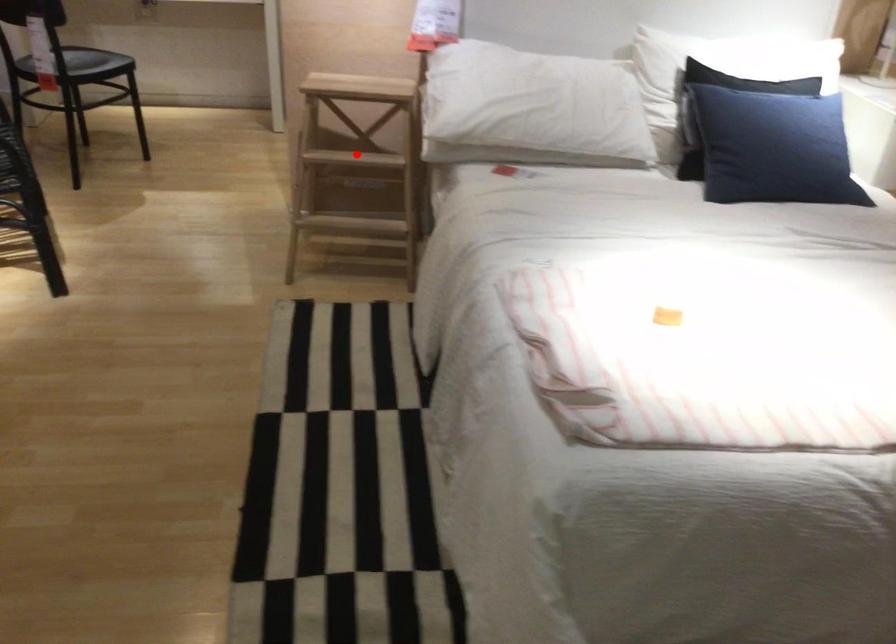
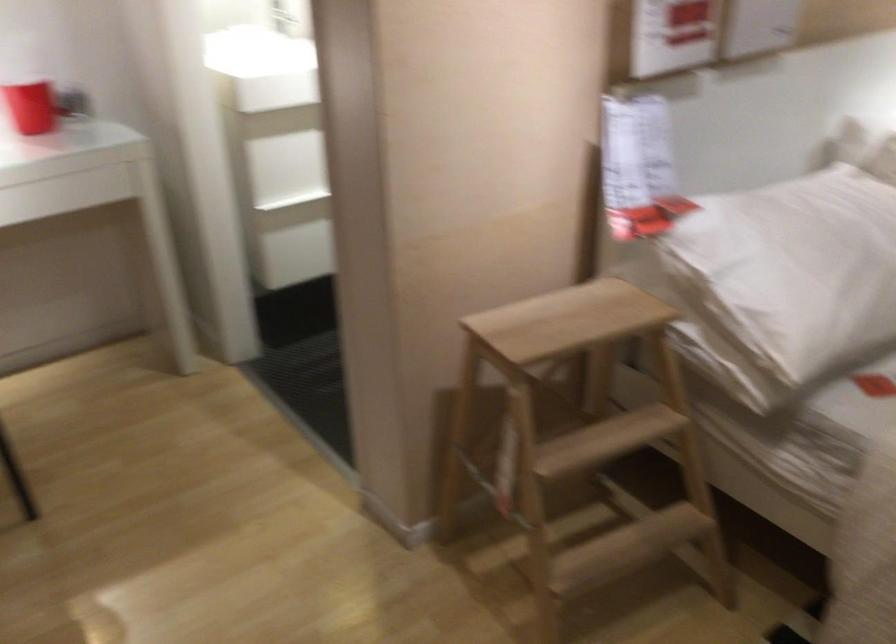
The point at the highlighted location is marked in the first image. Where is the corresponding point in the second image?

(582, 436)